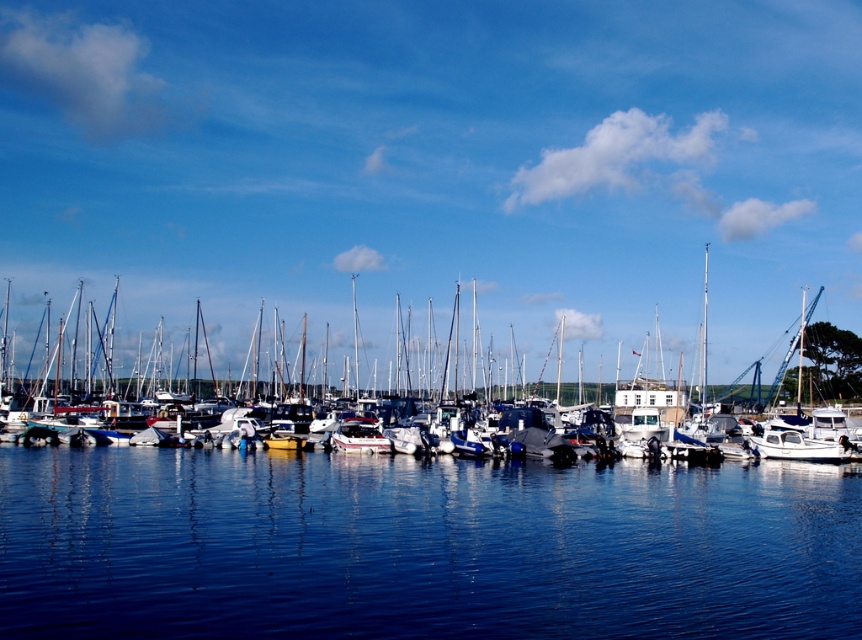
You are a photographer planning to capture the white matte boat at center and the blue smooth water at center in a single frame. Since you want both subjects to be clearly visible, which object should you prioritize focusing on, considering their sizes?

The white matte boat at center is bigger than the blue smooth water at center, so you should prioritize focusing on the white matte boat at center to ensure it is clearly visible in the frame.

You are standing on the dock and see the white matte boat at center and the blue smooth water at center. Which object is positioned to the right side?

The white matte boat at center is positioned to the right of the blue smooth water at center.

You are standing on the dock and looking at the white matte boat at center and the blue smooth water at center. Which one appears closer to you?

The white matte boat at center is further to the viewer than blue smooth water at center, so the white matte boat at center appears closer to you.